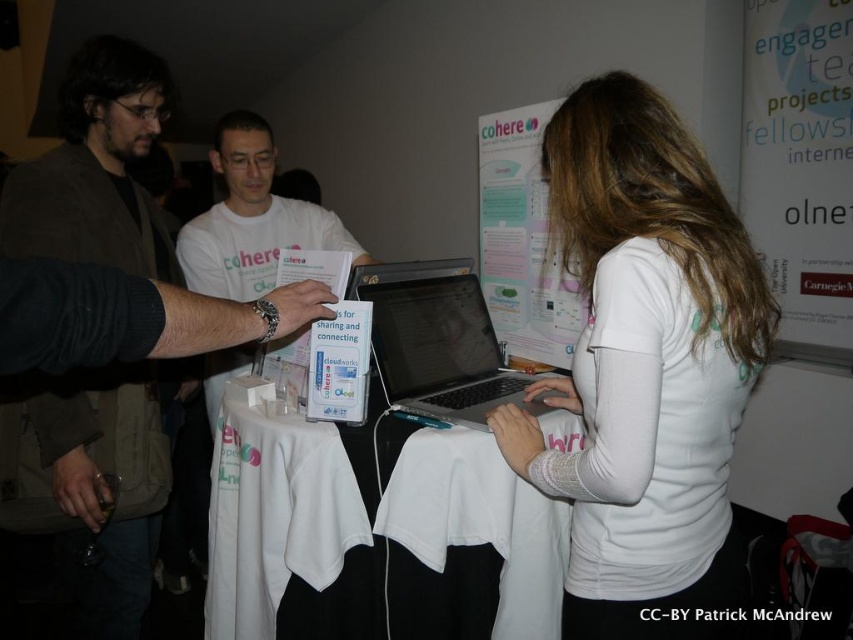
You are attending a workshop and need to hand out a document to the presenter. The presenter is standing near the matte black laptop at left and the white paper at center. Which object should you approach first to reach the presenter?

You should approach the matte black laptop at left first since it is closer to you than the white paper at center, so the presenter is likely near it.

Based on the photo, you are organizing a presentation and need to ensure that the white matte shirt at center and the matte black laptop at left are visible to the audience. Which object should you adjust to make sure both are clearly visible?

The white matte shirt at center is smaller than the matte black laptop at left, so you should adjust the position of the white matte shirt at center to ensure it is large enough or positioned in a way that both objects are clearly visible to the audience.